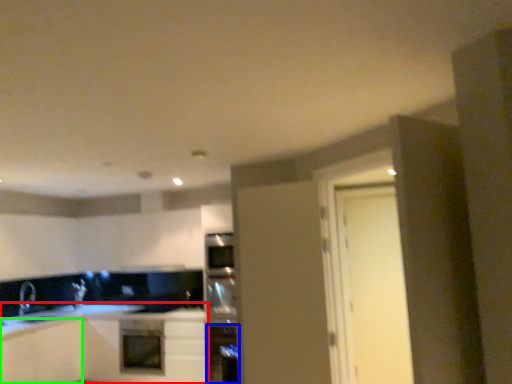
Question: Considering the real-world distances, which object is farthest from cabinetry (highlighted by a red box)? appliance (highlighted by a blue box) or cabinetry (highlighted by a green box)?

Choices:
 (A) appliance
 (B) cabinetry

Answer: (A)